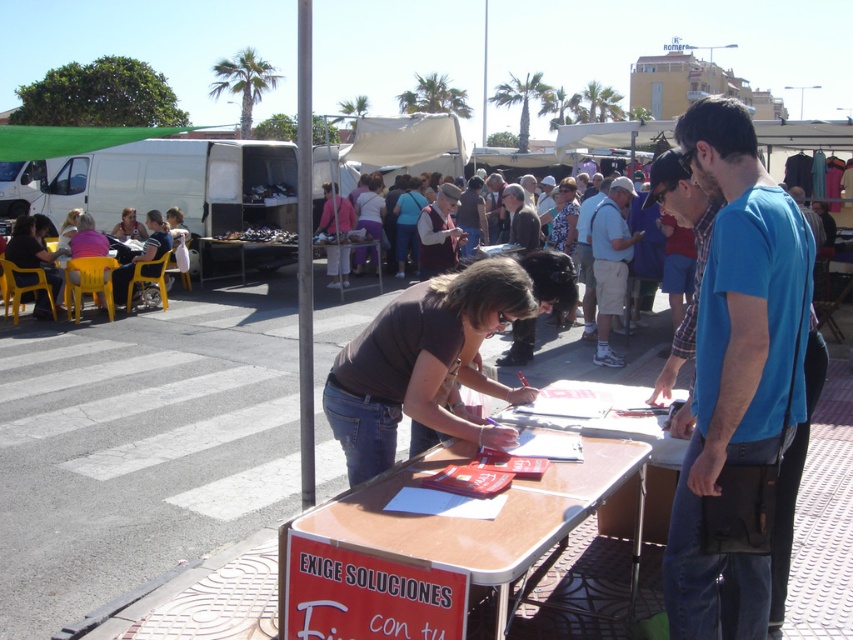
Is brown glossy table at center closer to camera compared to dark brown leather jacket at center?

Yes, it is in front of dark brown leather jacket at center.

Can you confirm if brown glossy table at center is thinner than dark brown leather jacket at center?

No.

Does point (370, 589) come in front of point (515, 225)?

That is True.

At what (x,y) coordinates should I click in order to perform the action: click on brown glossy table at center. Please return your answer as a coordinate pair (x, y). Looking at the image, I should click on point(437,545).

Is matte black shirt at center further to the viewer compared to matte black shirt at left?

No, matte black shirt at center is closer to the viewer.

Does matte black shirt at center have a greater height compared to matte black shirt at left?

No.

Who is more forward, [49,300] or [158,272]?

Point [49,300]

At what (x,y) coordinates should I click in order to perform the action: click on matte black shirt at center. Please return your answer as a coordinate pair (x, y). Looking at the image, I should click on pyautogui.click(x=32, y=262).

Can you confirm if blue cotton shirt at center is shorter than brown glossy table at center?

In fact, blue cotton shirt at center may be taller than brown glossy table at center.

Is point (737, 612) positioned before point (405, 545)?

No.

At what (x,y) coordinates should I click in order to perform the action: click on blue cotton shirt at center. Please return your answer as a coordinate pair (x, y). This screenshot has width=853, height=640. Looking at the image, I should click on (735, 362).